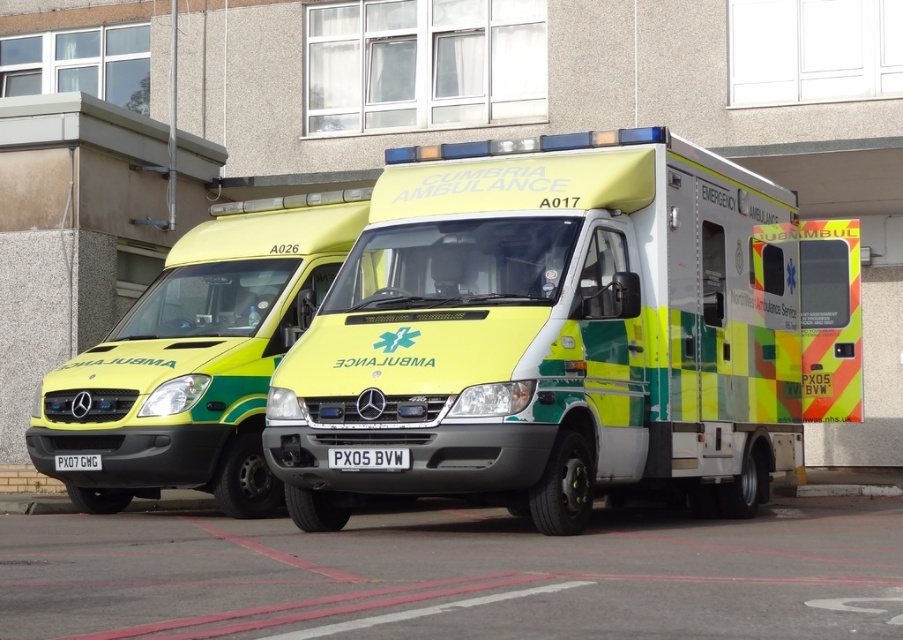
Question: Which object is farther from the camera taking this photo?

Choices:
 (A) yellow-green glossy ambulance at center
 (B) yellow/green plastic ambulance at center

Answer: (A)

Question: Does yellow/green plastic ambulance at center appear under yellow-green glossy ambulance at center?

Choices:
 (A) no
 (B) yes

Answer: (B)

Question: In this image, where is yellow/green plastic ambulance at center located relative to yellow-green glossy ambulance at center?

Choices:
 (A) left
 (B) right

Answer: (B)

Question: Is yellow/green plastic ambulance at center thinner than yellow-green glossy ambulance at center?

Choices:
 (A) no
 (B) yes

Answer: (B)